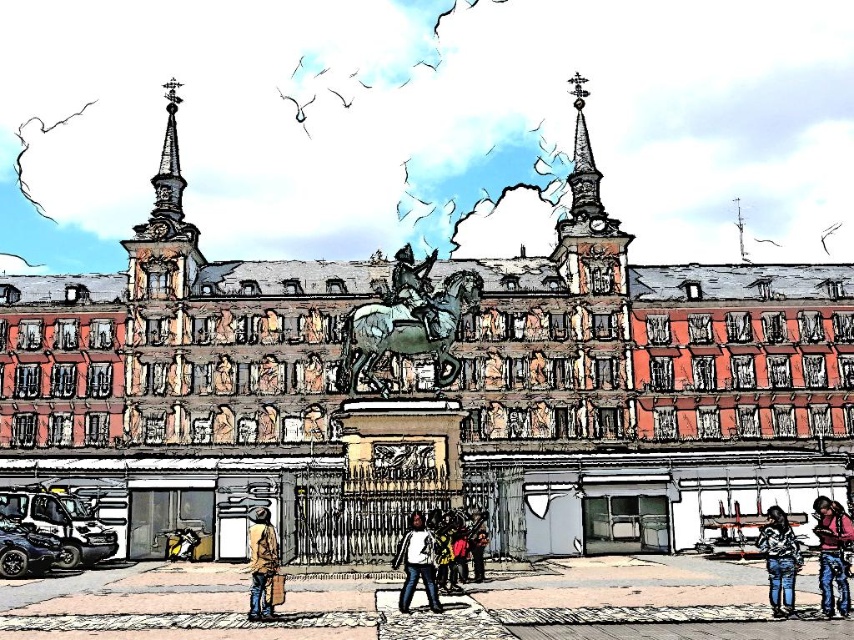
You are standing in the historical European square and notice two items of clothing. You see a denim jacket at lower right and a white matte shirt at center. Which clothing item is positioned higher in the scene?

The denim jacket at lower right is above the white matte shirt at center, so the denim jacket at lower right is positioned higher in the scene.

You are standing in the historical European square and notice a pink fabric jacket at lower right. Where exactly is the pink fabric jacket located in the square?

The pink fabric jacket at lower right is located at point (832,554) in the square.

You are an artist setting up an easel in the square to paint the statue. You have two items in your bag, the denim jacket at lower right and the white matte shirt at center. Which item should you place higher on your canvas to accurately represent their sizes?

The denim jacket at lower right should be placed higher on the canvas since it is taller than the white matte shirt at center.